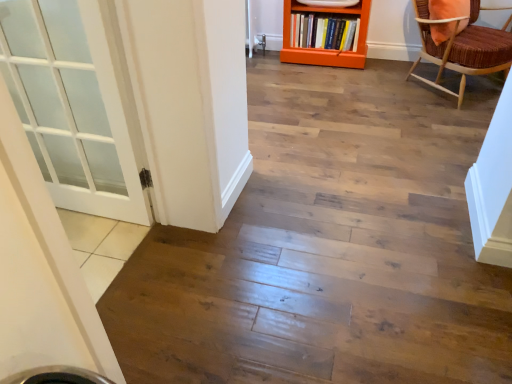
In order to click on vacant space to the left of brown woven chair at upper right in this screenshot , I will do `click(364, 101)`.